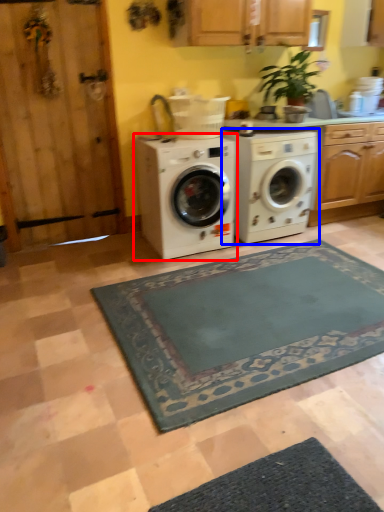
Question: Which of the following is the closest to the observer, washing machine (highlighted by a red box) or washing machine (highlighted by a blue box)?

Choices:
 (A) washing machine
 (B) washing machine

Answer: (A)